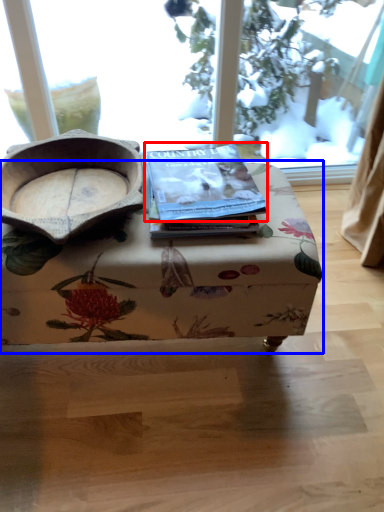
Question: Which object appears closest to the camera in this image, paperback book (highlighted by a red box) or table (highlighted by a blue box)?

Choices:
 (A) paperback book
 (B) table

Answer: (B)